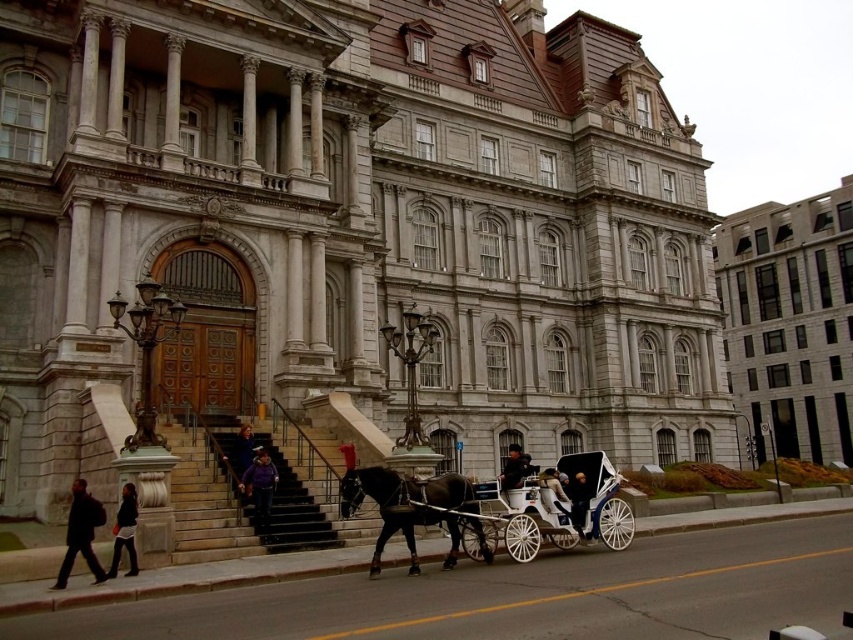
You are a visitor standing at the base of the stone steps in front of the historic building. You want to take a photo of the white stone building at right and the white polished wood horse cart at lower center together in the same frame. Which direction should you face to ensure both objects are visible in your camera view?

You should face towards the right side of the white polished wood horse cart at lower center to include both the white stone building at right and the white polished wood horse cart at lower center in your camera view since the white stone building at right is positioned to the right of the white polished wood horse cart at lower center.

From the picture: You are a person trying to decide which jacket to wear for a cold winter day. You have the purple fleece jacket at lower center and the light brown leather jacket at center. Which jacket would be better for keeping warm?

The light brown leather jacket at center is thicker than the purple fleece jacket at lower center, so it would provide better insulation and warmth for a cold winter day.

You are standing in front of the grand historic building and see the point at coordinates (260, 486). Based on the scene description, what object is located at that point?

The point at coordinates (260, 486) is located on the purple fleece jacket at lower center.